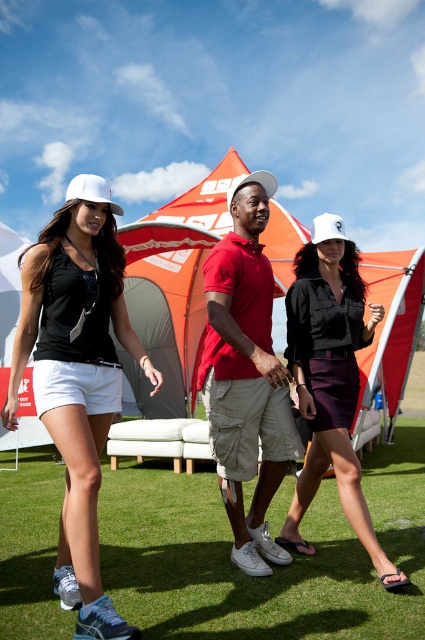
Who is shorter, matte black tank top at center or white matte baseball cap at left?

With less height is white matte baseball cap at left.

Is point (91, 259) in front of point (93, 189)?

No.

Identify the location of matte black tank top at center. 76,385.

Does matte black tank top at center have a larger size compared to white matte baseball hat at center?

Yes.

Which is more to the left, matte black tank top at center or white matte baseball hat at center?

From the viewer's perspective, matte black tank top at center appears more on the left side.

Measure the distance between point (79,208) and camera.

The distance of point (79,208) from camera is 12.47 feet.

This screenshot has height=640, width=425. Identify the location of matte black tank top at center. (76, 385).

Looking at this image, can you confirm if white matte baseball cap at left is smaller than white matte baseball hat at center?

No, white matte baseball cap at left is not smaller than white matte baseball hat at center.

Between white matte baseball cap at left and white matte baseball hat at center, which one is positioned lower?

white matte baseball hat at center

Measure the distance between white matte baseball cap at left and camera.

A distance of 3.60 meters exists between white matte baseball cap at left and camera.

Identify the location of white matte baseball cap at left. (91, 192).